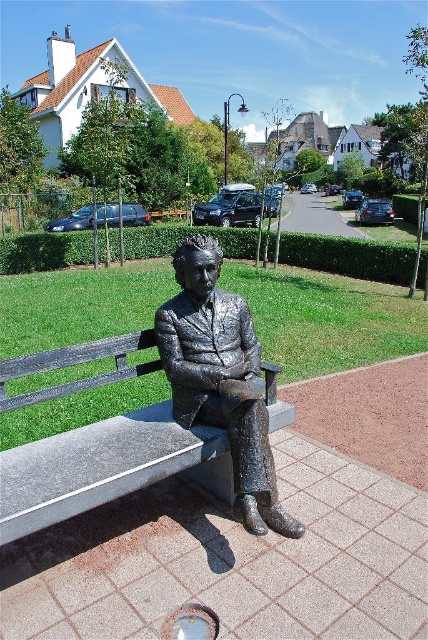
You are a park visitor who wants to sit on the smooth gray bench at center while also getting a clear view of the shiny bronze statue at center. Based on their heights, is it possible for you to do so comfortably?

The smooth gray bench at center is shorter than the shiny bronze statue at center, so sitting on the bench would allow you to comfortably see over it to view the statue.

You are a photographer standing in front of the smooth gray bench at center where the bronze statue of Albert Einstein is seated. You want to take a photo of the statue from a distance that allows you to capture the entire bench and statue without any cropping. Considering the statue is 1.8 meters tall, what is the minimum distance you should maintain from the bench to ensure the entire subject fits in your camera frame?

The minimum distance you should maintain from the smooth gray bench at center is 2.03 meters to ensure the entire statue and bench are captured without cropping, as this is the distance between the bench and the camera.

You are a maintenance worker who needs to clean the shiny bronze statue at center. You have a 12 inch long cleaning tool. Can you reach the statue from the smooth gray bench at center without moving the bench?

The distance between the smooth gray bench at center and the shiny bronze statue at center is 15.50 inches. Since your tool is 12 inches long, it is not long enough to reach the statue from the bench. You will need a longer tool or move closer.